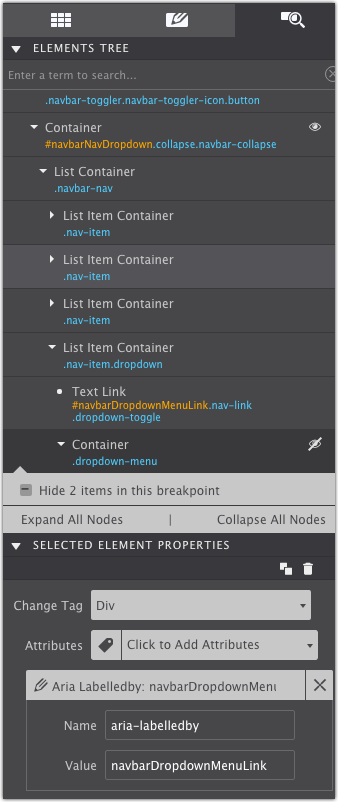
Where is `trash`? trash is located at coordinates (309, 569).